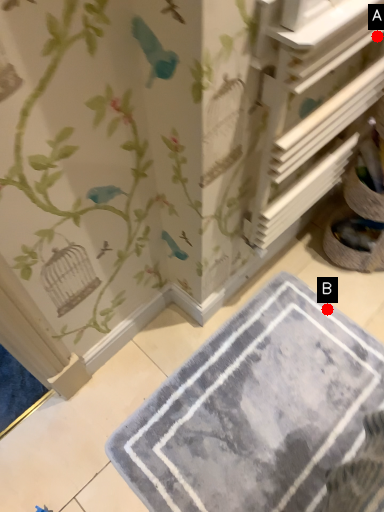
Question: Two points are circled on the image, labeled by A and B beside each circle. Which point appears closest to the camera in this image?

Choices:
 (A) A is closer
 (B) B is closer

Answer: (A)